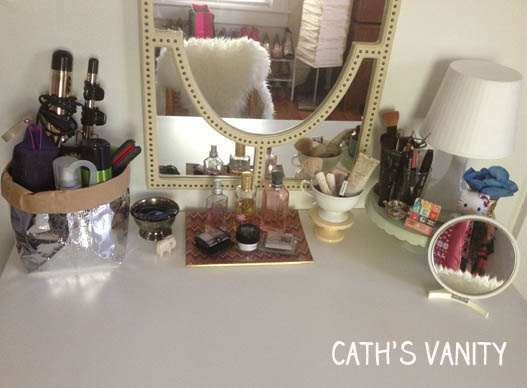
The height and width of the screenshot is (388, 527). Find the location of `lamp`. lamp is located at coordinates (452, 191).